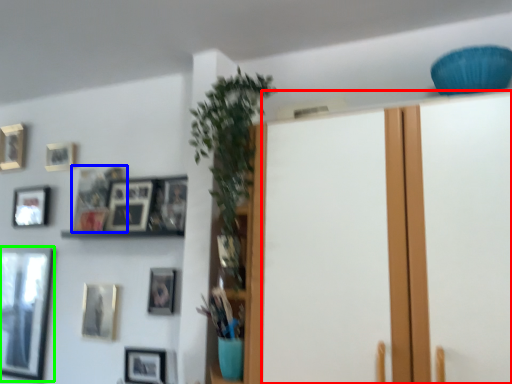
Question: Which object is positioned closest to door (highlighted by a red box)? Select from picture frame (highlighted by a blue box) and picture frame (highlighted by a green box).

Choices:
 (A) picture frame
 (B) picture frame

Answer: (A)